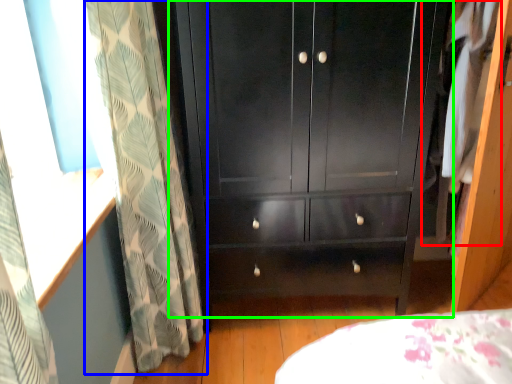
Question: Estimate the real-world distances between objects in this image. Which object is farther from clothing (highlighted by a red box), curtain (highlighted by a blue box) or cupboard (highlighted by a green box)?

Choices:
 (A) curtain
 (B) cupboard

Answer: (A)